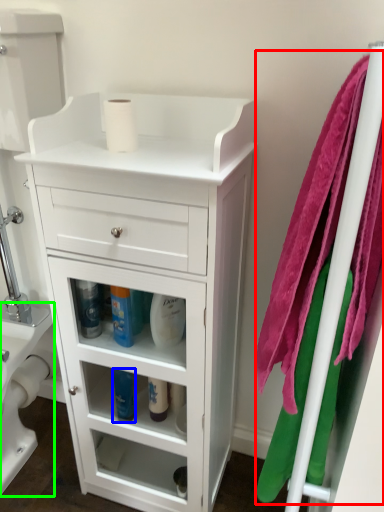
Question: Based on their relative distances, which object is farther from bath towel (highlighted by a red box)? Choose from cleaning product (highlighted by a blue box) and toilet bowl (highlighted by a green box).

Choices:
 (A) cleaning product
 (B) toilet bowl

Answer: (B)